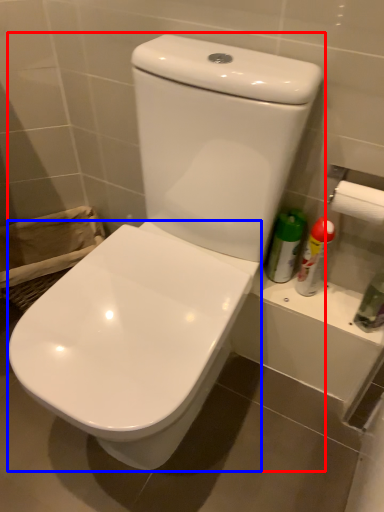
Question: Which object is further to the camera taking this photo, toilet (highlighted by a red box) or toilet (highlighted by a blue box)?

Choices:
 (A) toilet
 (B) toilet

Answer: (B)